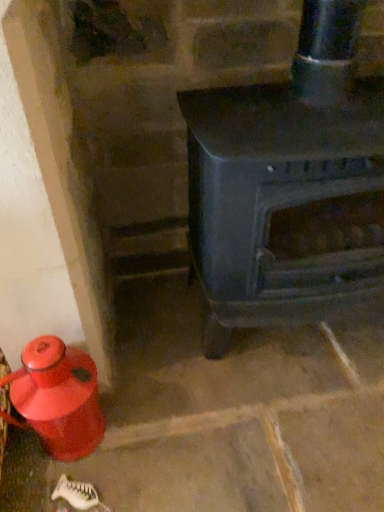
What do you see at coordinates (286, 183) in the screenshot?
I see `matte black wood burning stove at right` at bounding box center [286, 183].

The width and height of the screenshot is (384, 512). Identify the location of matte black wood burning stove at right. (286, 183).

You are a GUI agent. You are given a task and a screenshot of the screen. Output one action in this format:
    pyautogui.click(x=<x>, y=<y>)
    Task: Click on the matte black wood burning stove at right
    Image resolution: width=384 pixels, height=512 pixels.
    Given the screenshot: What is the action you would take?
    pyautogui.click(x=286, y=183)